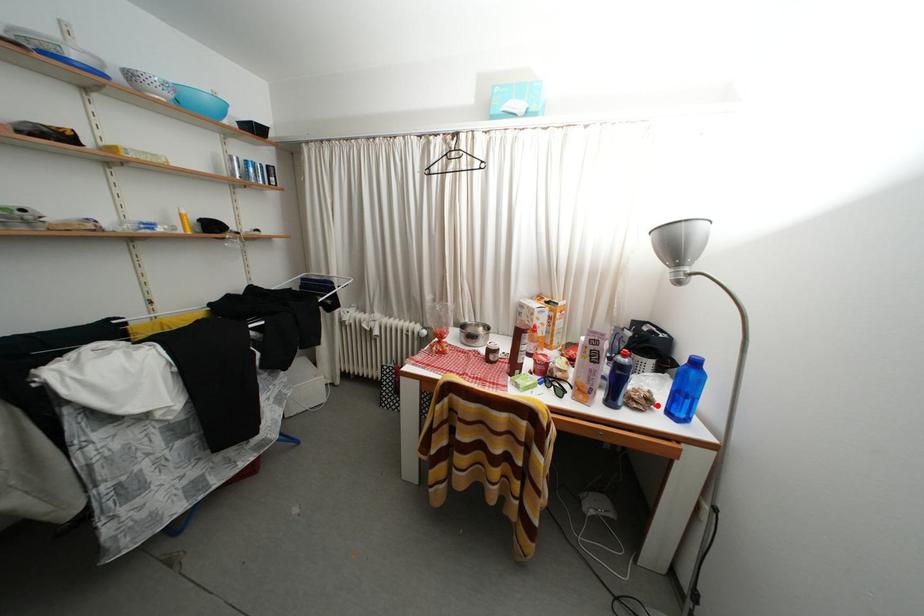
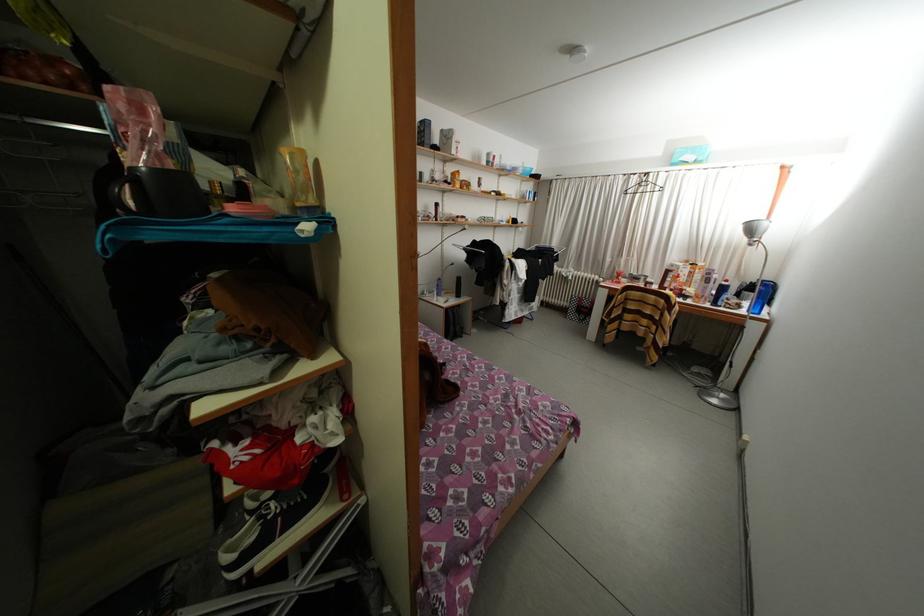
In the second image, find the point that corresponds to the highlighted location in the first image.

(747, 310)